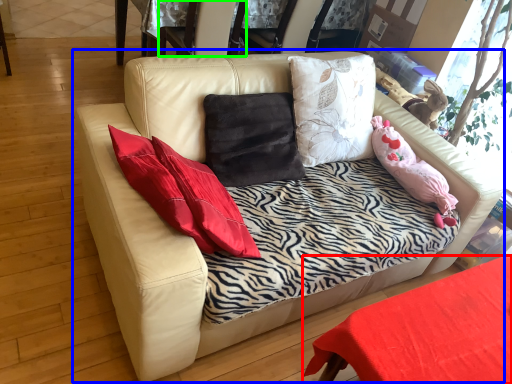
Question: Estimate the real-world distances between objects in this image. Which object is farther from table (highlighted by a red box), studio couch (highlighted by a blue box) or armchair (highlighted by a green box)?

Choices:
 (A) studio couch
 (B) armchair

Answer: (B)